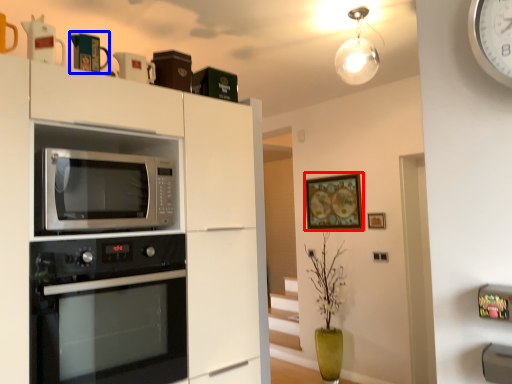
Question: Which object is closer to the camera taking this photo, picture frame (highlighted by a red box) or appliance (highlighted by a blue box)?

Choices:
 (A) picture frame
 (B) appliance

Answer: (B)